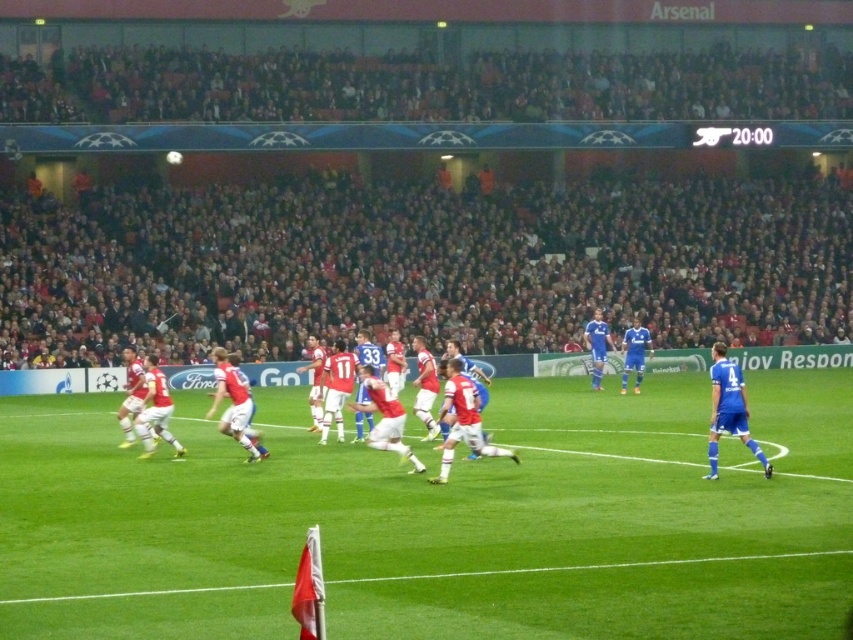
Question: Is green grass football field at center thinner than blue smooth jersey at right?

Choices:
 (A) yes
 (B) no

Answer: (B)

Question: Does green grass football field at center appear under blue smooth jersey at right?

Choices:
 (A) no
 (B) yes

Answer: (B)

Question: Which point appears closest to the camera in this image?

Choices:
 (A) (721, 403)
 (B) (194, 474)

Answer: (A)

Question: Which point is closer to the camera taking this photo?

Choices:
 (A) (781, 468)
 (B) (724, 374)

Answer: (B)

Question: Which object appears closest to the camera in this image?

Choices:
 (A) blue smooth jersey at right
 (B) green grass football field at center

Answer: (B)

Question: Does green grass football field at center appear under blue smooth jersey at right?

Choices:
 (A) yes
 (B) no

Answer: (A)